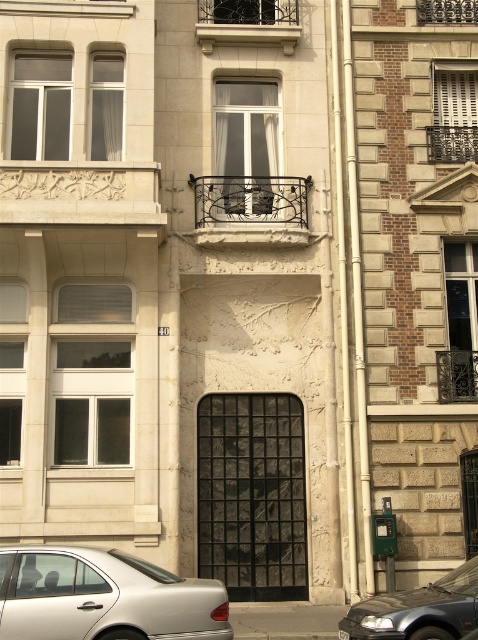
In the scene shown: Is silver metallic car at lower left positioned at the back of black wrought iron balcony at upper center?

That is False.

Image resolution: width=478 pixels, height=640 pixels. What do you see at coordinates (104, 596) in the screenshot?
I see `silver metallic car at lower left` at bounding box center [104, 596].

Identify the location of silver metallic car at lower left. (104, 596).

Measure the distance from silver metallic car at lower left to wrought iron balcony at center.

silver metallic car at lower left is 10.19 meters from wrought iron balcony at center.

Does silver metallic car at lower left appear over wrought iron balcony at center?

Incorrect, silver metallic car at lower left is not positioned above wrought iron balcony at center.

Between point (140, 566) and point (256, 196), which one is positioned in front?

Point (140, 566)

What are the coordinates of `silver metallic car at lower left` in the screenshot? It's located at (104, 596).

Is the position of black wrought iron balcony at upper center more distant than that of green plastic parking meter at lower right?

Yes, it is behind green plastic parking meter at lower right.

Find the location of a particular element. black wrought iron balcony at upper center is located at coordinates (248, 22).